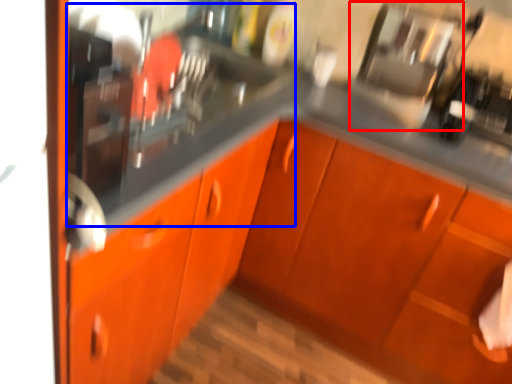
Question: Which of the following is the farthest to the observer, appliance (highlighted by a red box) or sink (highlighted by a blue box)?

Choices:
 (A) appliance
 (B) sink

Answer: (A)